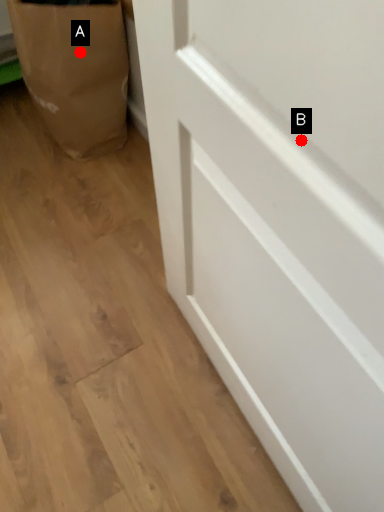
Question: Two points are circled on the image, labeled by A and B beside each circle. Which point is farther from the camera taking this photo?

Choices:
 (A) A is further
 (B) B is further

Answer: (A)